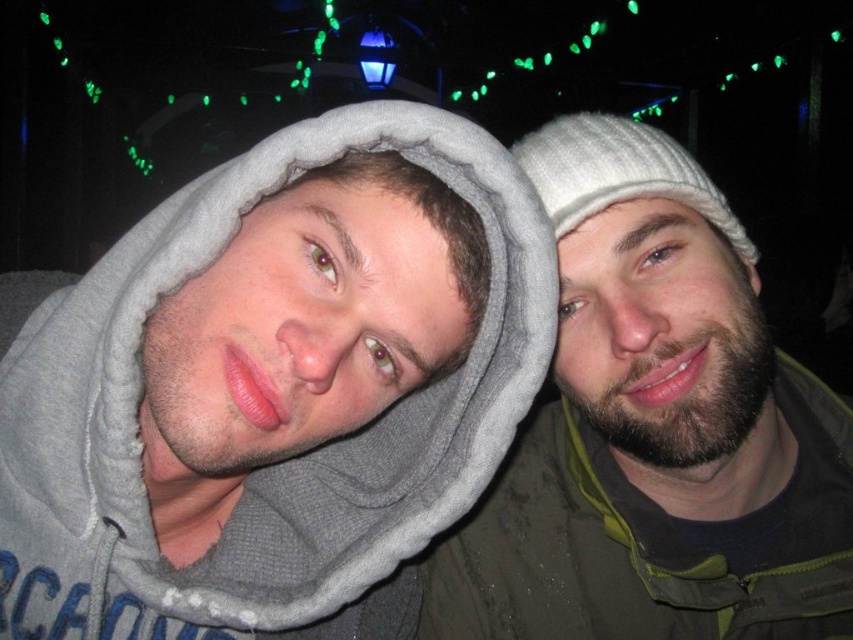
Question: Which point appears farthest from the camera in this image?

Choices:
 (A) (274, 632)
 (B) (601, 195)
 (C) (527, 624)

Answer: (C)

Question: Is gray fleece hoodie at left to the left of bearded man at right from the viewer's perspective?

Choices:
 (A) no
 (B) yes

Answer: (B)

Question: Is gray fleece hoodie at left smaller than bearded man at right?

Choices:
 (A) yes
 (B) no

Answer: (A)

Question: Among these points, which one is farthest from the camera?

Choices:
 (A) 461,534
 (B) 608,141
 (C) 274,605

Answer: (A)

Question: Estimate the real-world distances between objects in this image. Which object is farther from the bearded man at right?

Choices:
 (A) white knitted hat at upper right
 (B) gray fleece hoodie at left

Answer: (B)

Question: Can you confirm if gray fleece hoodie at left is bigger than bearded man at right?

Choices:
 (A) no
 (B) yes

Answer: (A)